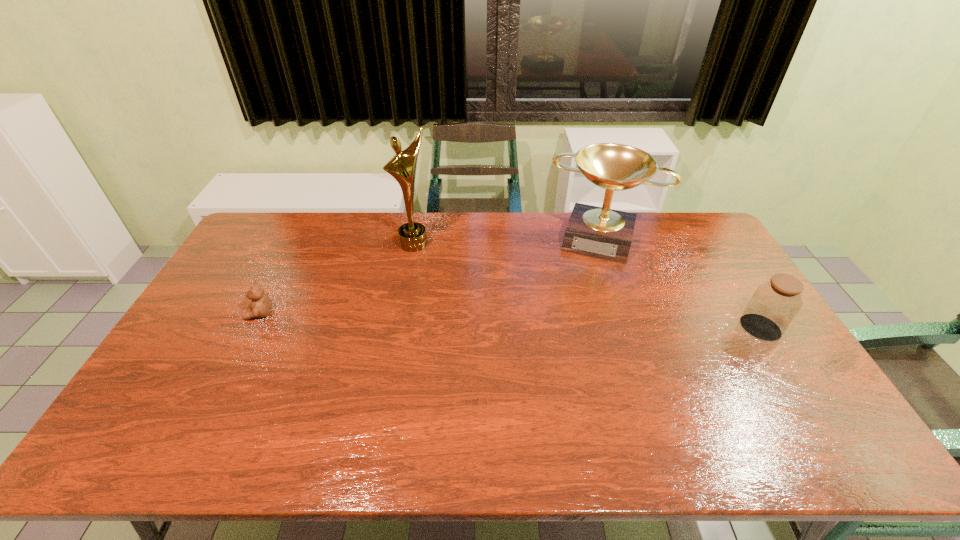
Image resolution: width=960 pixels, height=540 pixels. I want to click on vacant space on the desktop that is between the shortest object and the rightmost object and is positioned on the front-facing side of the third object from right to left, so click(x=493, y=320).

Locate an element on the screen. This screenshot has height=540, width=960. free space on the desktop that is between the teddy bear and the rightmost object and is positioned on the front-facing side of the right award is located at coordinates point(579,323).